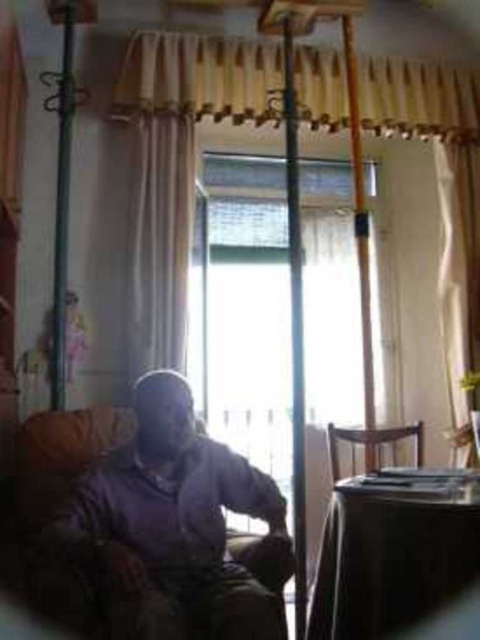
You are a delivery person trying to place a package on the table between the beige textured curtain at center and the brown wooden chair at lower right. The package is 1.3 meters wide. Will the package fit between them?

The distance between the beige textured curtain at center and the brown wooden chair at lower right is 1.26 meters, which is shorter than the package width of 1.3 meters. The package will not fit between them.

You are standing in the living room and want to pick up the matte purple sweater at center. Based on its position, which direction should you move relative to the sofa where the person is sitting?

The matte purple sweater at center is located at point coordinates that are to the right of the sofa. Since the person is sitting on the sofa facing away from the camera towards the window, you should move to the right side of the sofa to reach the sweater.